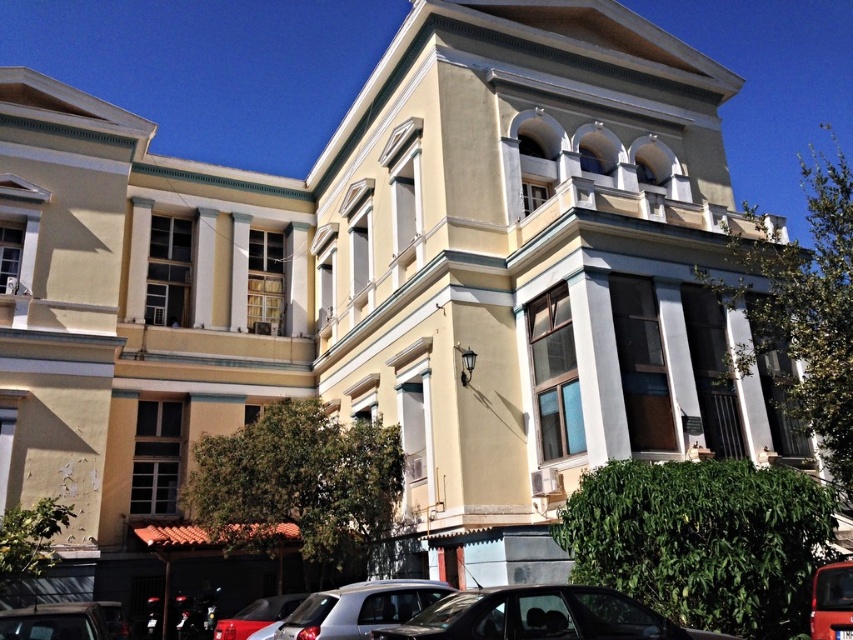
You are a pedestrian standing in front of the building and want to cross the street. You see the silver metallic car at lower center and the matte red bus at lower right. Which vehicle is closer to you?

The silver metallic car at lower center is closer to you because the matte red bus at lower right is behind it.

You are a delivery person who needs to park your vehicle which is 4 meters wide. You see the shiny black car at lower right and the shiny red car at lower center in the parking lot. Can you fit your vehicle between them?

The shiny black car at lower right is wider than the shiny red car at lower center. Since your vehicle is 4 meters wide, you need to check the space between them. However, without knowing the exact distance between the cars, we can only confirm the width comparison. If the space between them is at least 4 meters, then it would fit.